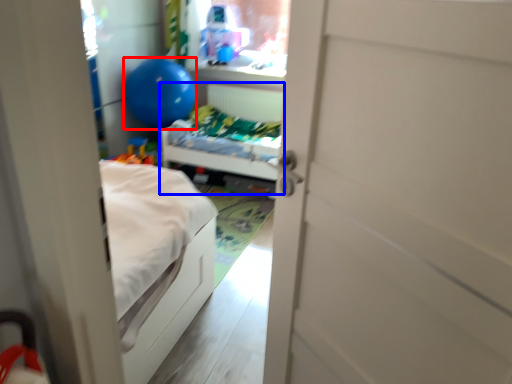
Question: Which of the following is the closest to the observer, balloon (highlighted by a red box) or hospital bed (highlighted by a blue box)?

Choices:
 (A) balloon
 (B) hospital bed

Answer: (B)